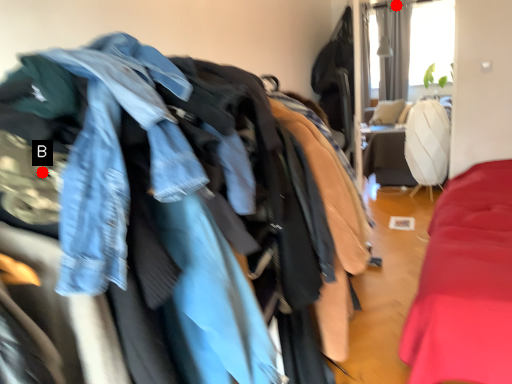
Question: Two points are circled on the image, labeled by A and B beside each circle. Which point appears closest to the camera in this image?

Choices:
 (A) A is closer
 (B) B is closer

Answer: (B)